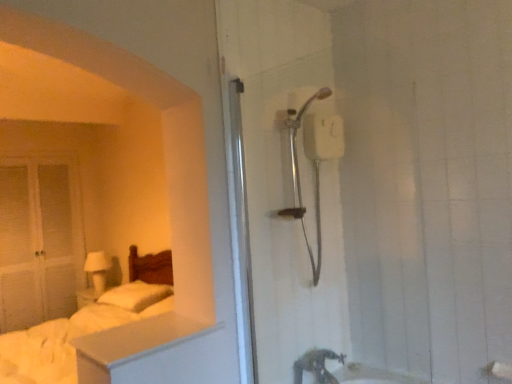
Measure the distance between point (325, 369) and camera.

The depth of point (325, 369) is 6.94 feet.

Locate an element on the screen. This screenshot has width=512, height=384. white matte dresser at lower left is located at coordinates (153, 352).

Find the location of a particular element. The width and height of the screenshot is (512, 384). white soft bed at left is located at coordinates (86, 324).

Considering the relative sizes of white matte dresser at lower left and white soft pillow at left in the image provided, is white matte dresser at lower left wider than white soft pillow at left?

Correct, the width of white matte dresser at lower left exceeds that of white soft pillow at left.

Would you say white matte dresser at lower left is a long distance from white soft pillow at left?

Yes.

Is white matte dresser at lower left positioned beyond the bounds of white soft pillow at left?

white matte dresser at lower left lies outside white soft pillow at left's area.

Is white matte dresser at lower left shorter than white soft pillow at left?

Correct, white matte dresser at lower left is not as tall as white soft pillow at left.

Considering the sizes of objects matte silver tap at lower center and white matte lampshade at left in the image provided, who is bigger, matte silver tap at lower center or white matte lampshade at left?

white matte lampshade at left is bigger.

Is matte silver tap at lower center inside or outside of white matte lampshade at left?

matte silver tap at lower center lies outside white matte lampshade at left.

Can you confirm if matte silver tap at lower center is thinner than white matte lampshade at left?

Indeed, matte silver tap at lower center has a lesser width compared to white matte lampshade at left.

Which object is further away from the camera, matte silver tap at lower center or white matte lampshade at left?

white matte lampshade at left.

Who is shorter, matte silver tap at lower center or white soft pillow at left?

Standing shorter between the two is matte silver tap at lower center.

From the image's perspective, which one is positioned higher, matte silver tap at lower center or white soft pillow at left?

matte silver tap at lower center is shown above in the image.

Considering the positions of objects matte silver tap at lower center and white soft pillow at left in the image provided, who is more to the right, matte silver tap at lower center or white soft pillow at left?

matte silver tap at lower center is more to the right.

Where is `pillow behind the matte silver tap at lower center`? The width and height of the screenshot is (512, 384). pillow behind the matte silver tap at lower center is located at coordinates (135, 296).

Which of these two, white matte glass door at left or white soft bed at left, stands taller?

Standing taller between the two is white matte glass door at left.

This screenshot has height=384, width=512. I want to click on glass door that is on the left side of white soft bed at left, so click(x=39, y=241).

Is white matte glass door at left smaller than white soft bed at left?

Yes, white matte glass door at left is smaller than white soft bed at left.

From a real-world perspective, is white soft bed at left positioned over white matte glass door at left based on gravity?

No, from a real-world perspective, white soft bed at left is not on top of white matte glass door at left.

Does point (42, 336) come behind point (6, 247)?

No, (42, 336) is in front of (6, 247).

Which of these two, white matte dresser at lower left or white matte glass door at left, stands taller?

white matte glass door at left is taller.

Does point (91, 360) lie behind point (82, 227)?

No, (91, 360) is in front of (82, 227).

Between white matte dresser at lower left and white matte glass door at left, which one has smaller width?

white matte glass door at left is thinner.

From the image's perspective, is white matte dresser at lower left above or below white matte glass door at left?

Based on their image positions, white matte dresser at lower left is located beneath white matte glass door at left.

Which of these two, white matte lampshade at left or matte silver tap at lower center, stands shorter?

matte silver tap at lower center is shorter.

From the image's perspective, does white matte lampshade at left appear lower than matte silver tap at lower center?

Incorrect, from the image's perspective, white matte lampshade at left is higher than matte silver tap at lower center.

Which is correct: white matte lampshade at left is inside matte silver tap at lower center, or outside of it?

white matte lampshade at left exists outside the volume of matte silver tap at lower center.

Looking at the image, does white matte lampshade at left seem bigger or smaller compared to matte silver tap at lower center?

Clearly, white matte lampshade at left is larger in size than matte silver tap at lower center.

This screenshot has width=512, height=384. What are the coordinates of `dresser above the white soft pillow at left (from a real-world perspective)` in the screenshot? It's located at (153, 352).

The height and width of the screenshot is (384, 512). Identify the location of tap on the right of the white matte lampshade at left. (316, 365).

When comparing their distances from white soft pillow at left, does white matte lampshade at left or white matte glass door at left seem closer?

Based on the image, white matte lampshade at left appears to be nearer to white soft pillow at left.

Looking at the image, which one is located closer to white soft bed at left, matte silver tap at lower center or white matte glass door at left?

Based on the image, white matte glass door at left appears to be nearer to white soft bed at left.

Based on their spatial positions, is white soft pillow at left or white matte glass door at left further from white matte dresser at lower left?

white matte glass door at left.

Based on their spatial positions, is white matte dresser at lower left or white soft bed at left further from white matte lampshade at left?

white matte dresser at lower left.

Estimate the real-world distances between objects in this image. Which object is closer to white soft bed at left, white soft pillow at left or white matte lampshade at left?

white soft pillow at left is closer to white soft bed at left.

From the image, which object appears to be farther from matte silver tap at lower center, white soft pillow at left or white matte dresser at lower left?

Based on the image, white soft pillow at left appears to be further to matte silver tap at lower center.

Looking at this image, when comparing their distances from white matte lampshade at left, does white matte glass door at left or white soft pillow at left seem further?

The object further to white matte lampshade at left is white soft pillow at left.

Looking at the image, which one is located closer to matte silver tap at lower center, white matte dresser at lower left or white matte lampshade at left?

Among the two, white matte dresser at lower left is located nearer to matte silver tap at lower center.

At what (x,y) coordinates should I click in order to perform the action: click on lamp between white matte glass door at left and white soft pillow at left. Please return your answer as a coordinate pair (x, y). The height and width of the screenshot is (384, 512). Looking at the image, I should click on (98, 270).

Image resolution: width=512 pixels, height=384 pixels. Find the location of `dresser situated between white soft bed at left and matte silver tap at lower center from left to right`. dresser situated between white soft bed at left and matte silver tap at lower center from left to right is located at coordinates (153, 352).

Locate an element on the screen. This screenshot has width=512, height=384. pillow between white soft bed at left and white matte glass door at left from front to back is located at coordinates (135, 296).

Identify the location of glass door between white soft bed at left and white matte lampshade at left from front to back. The height and width of the screenshot is (384, 512). (39, 241).